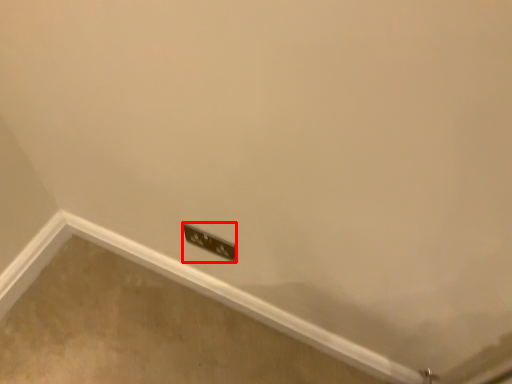
Question: Considering the relative positions of power plugs and sockets (annotated by the red box) and concrete in the image provided, where is power plugs and sockets (annotated by the red box) located with respect to the staircase?

Choices:
 (A) left
 (B) right

Answer: (A)